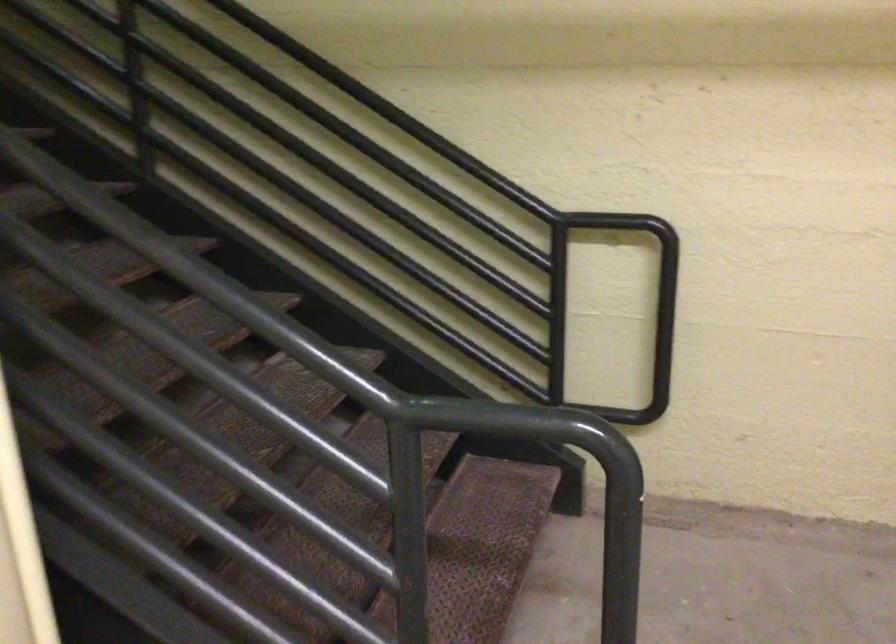
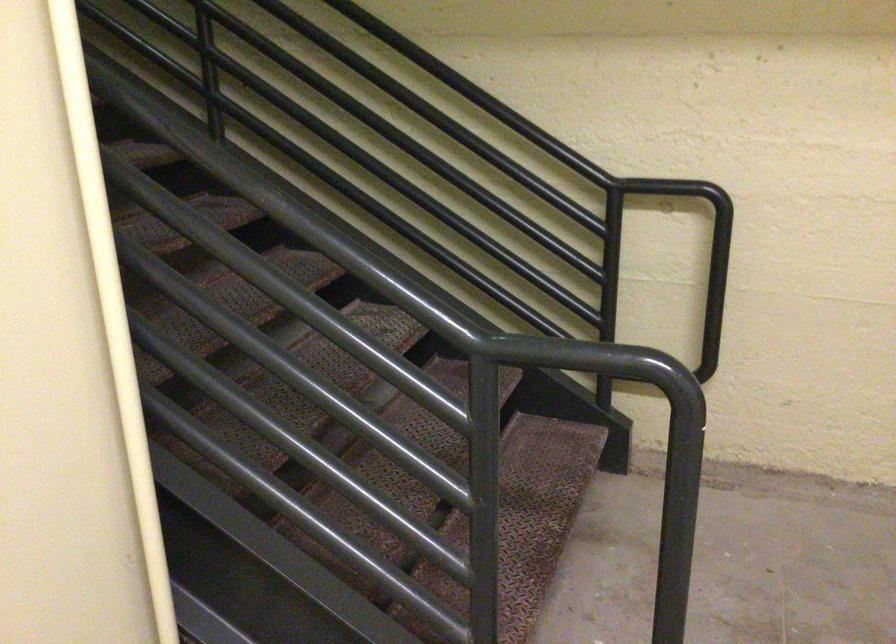
The point at [487,167] is marked in the first image. Where is the corresponding point in the second image?

(546, 129)